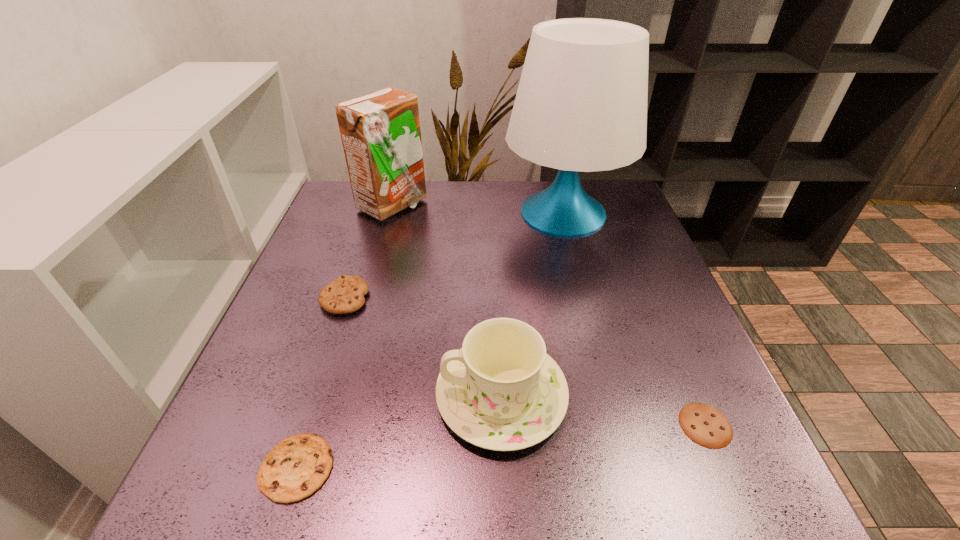
Find the location of a particular element. vacant point at the far right corner is located at coordinates (633, 207).

The width and height of the screenshot is (960, 540). Find the location of `free space between the tallest object and the shortest object`. free space between the tallest object and the shortest object is located at coordinates (635, 319).

I want to click on free point between the third tallest object and the second tallest object, so click(446, 301).

Find the location of `free spot between the carton and the table lamp`. free spot between the carton and the table lamp is located at coordinates (478, 210).

I want to click on vacant area that lies between the tallest cookie and the table lamp, so click(454, 255).

The width and height of the screenshot is (960, 540). I want to click on empty space between the farthest cookie and the third tallest object, so 423,347.

Where is `free space between the table lamp and the third tallest object`? Image resolution: width=960 pixels, height=540 pixels. free space between the table lamp and the third tallest object is located at coordinates (533, 304).

Where is `unoccupied position between the table lamp and the shortest object`? unoccupied position between the table lamp and the shortest object is located at coordinates (635, 319).

The width and height of the screenshot is (960, 540). In order to click on unoccupied position between the table lamp and the shortest object in this screenshot , I will do `click(635, 319)`.

I want to click on free space between the carton and the third farthest object, so click(x=369, y=252).